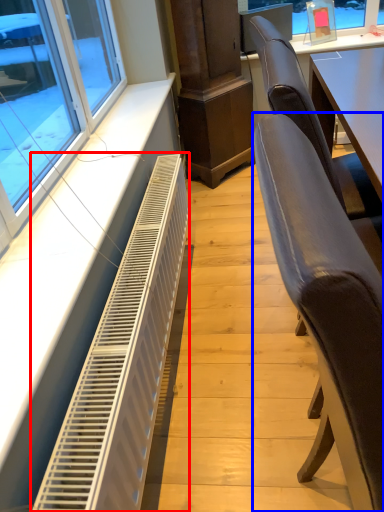
Question: Among these objects, which one is farthest to the camera, air conditioning (highlighted by a red box) or chair (highlighted by a blue box)?

Choices:
 (A) air conditioning
 (B) chair

Answer: (A)